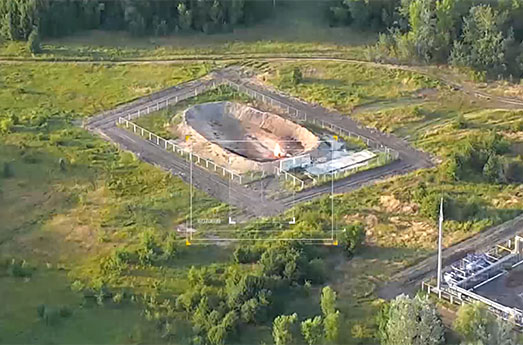
Where is `bowl`? The width and height of the screenshot is (523, 345). bowl is located at coordinates [237, 127].